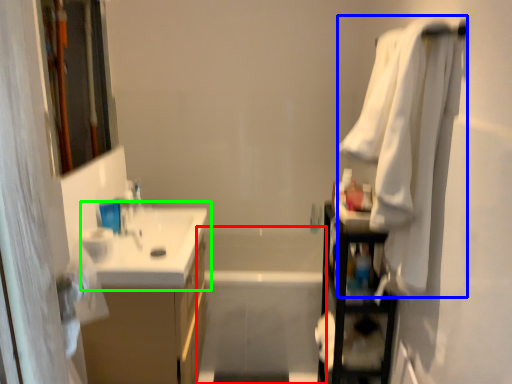
Question: Estimate the real-world distances between objects in this image. Which object is closer to bath (highlighted by a red box), bath towel (highlighted by a blue box) or sink (highlighted by a green box)?

Choices:
 (A) bath towel
 (B) sink

Answer: (B)